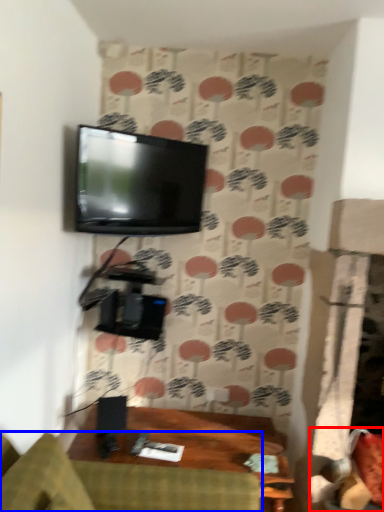
Question: Which object appears farthest to the camera in this image, swivel chair (highlighted by a red box) or studio couch (highlighted by a blue box)?

Choices:
 (A) swivel chair
 (B) studio couch

Answer: (A)